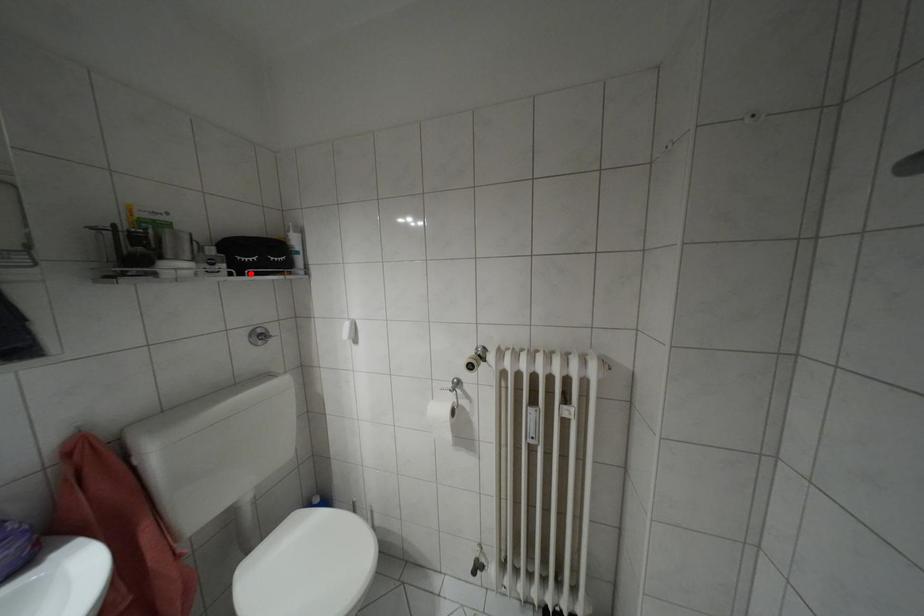
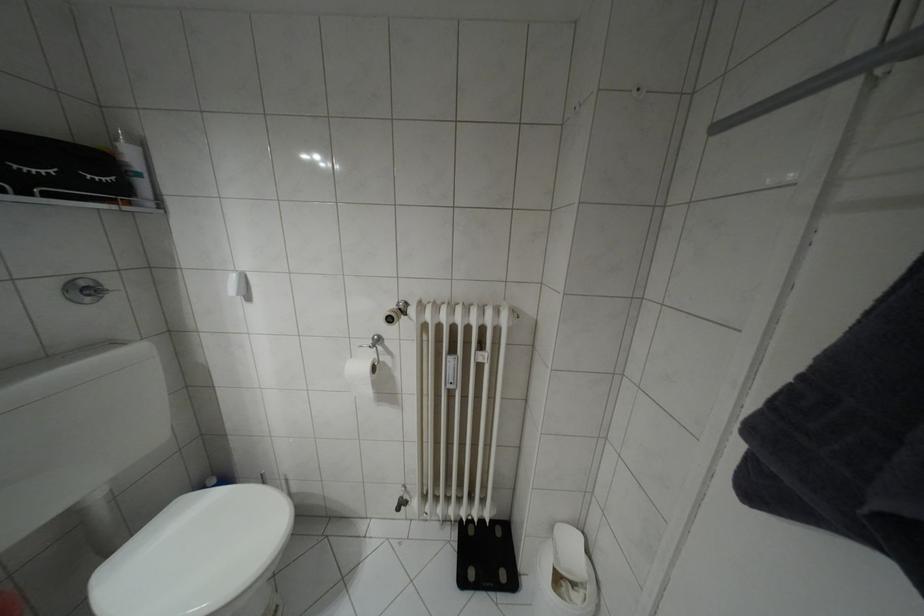
Where in the second image is the point corresponding to the highlighted location from the first image?

(49, 195)